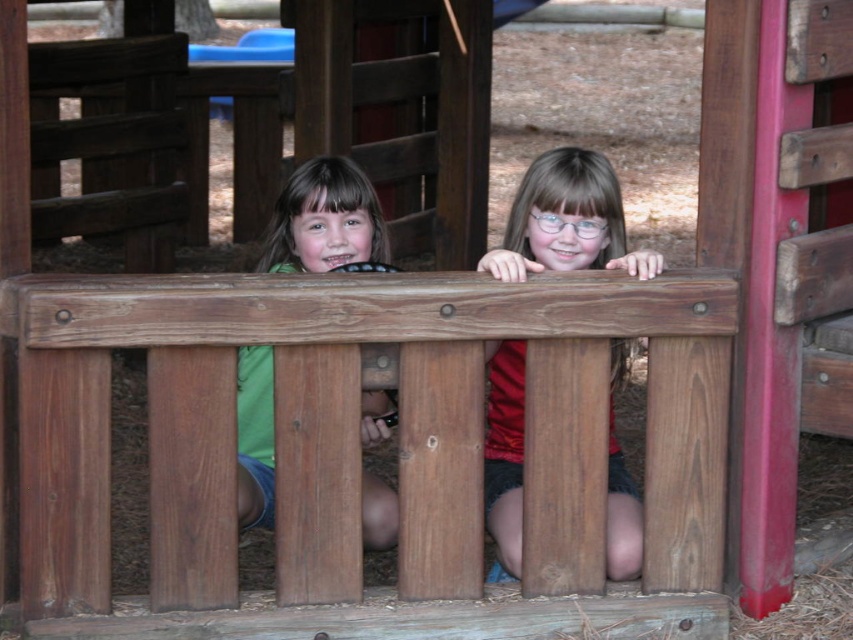
Question: Which object is farther from the camera taking this photo?

Choices:
 (A) matte red shirt at center
 (B) green matte shirt at center

Answer: (B)

Question: Based on their relative distances, which object is nearer to the green matte shirt at center?

Choices:
 (A) matte red shirt at center
 (B) blue plastic slide at upper center

Answer: (A)

Question: Does matte red shirt at center lie behind blue plastic slide at upper center?

Choices:
 (A) no
 (B) yes

Answer: (A)

Question: Does matte red shirt at center come behind blue plastic slide at upper center?

Choices:
 (A) no
 (B) yes

Answer: (A)

Question: Which point is closer to the camera taking this photo?

Choices:
 (A) (239, 461)
 (B) (624, 253)

Answer: (B)

Question: Is matte red shirt at center in front of green matte shirt at center?

Choices:
 (A) no
 (B) yes

Answer: (B)